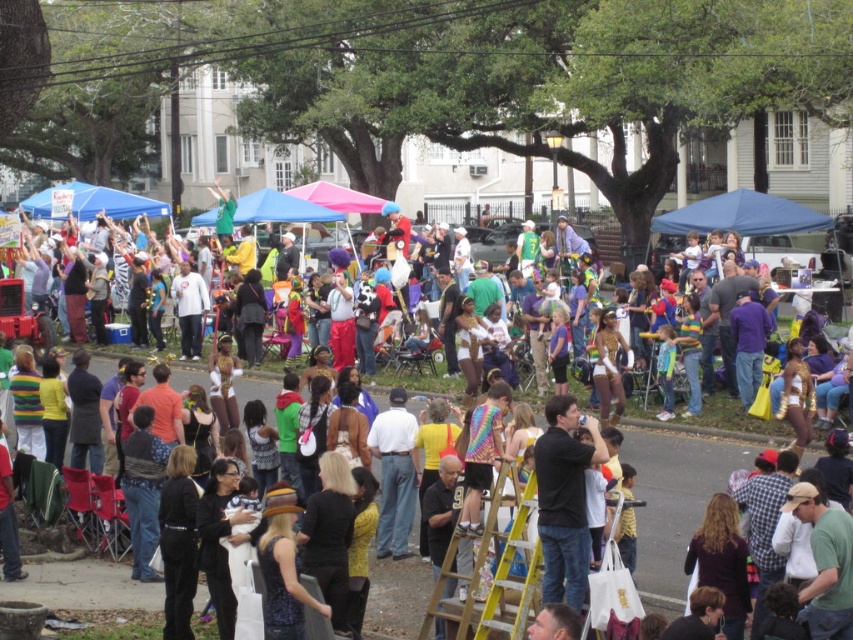
Between yellow/yellowish wood ladder at center and black t-shirt at center, which one has less height?

yellow/yellowish wood ladder at center

Locate an element on the screen. The width and height of the screenshot is (853, 640). yellow/yellowish wood ladder at center is located at coordinates (490, 564).

Between ruffled yellow dress at center and black t-shirt at center, which one is positioned lower?

black t-shirt at center is lower down.

Between point (668, 564) and point (552, 525), which one is positioned behind?

The point (668, 564) is behind.

I want to click on ruffled yellow dress at center, so click(674, 497).

You are a GUI agent. You are given a task and a screenshot of the screen. Output one action in this format:
    pyautogui.click(x=<x>, y=<y>)
    Task: Click on the ruffled yellow dress at center
    
    Given the screenshot: What is the action you would take?
    pyautogui.click(x=674, y=497)

Is ruffled yellow dress at center to the right of yellow/yellowish wood ladder at center from the viewer's perspective?

No, ruffled yellow dress at center is not to the right of yellow/yellowish wood ladder at center.

Can you confirm if ruffled yellow dress at center is thinner than yellow/yellowish wood ladder at center?

No, ruffled yellow dress at center is not thinner than yellow/yellowish wood ladder at center.

Is point (631, 442) less distant than point (466, 538)?

No, it is behind (466, 538).

The height and width of the screenshot is (640, 853). Identify the location of ruffled yellow dress at center. (674, 497).